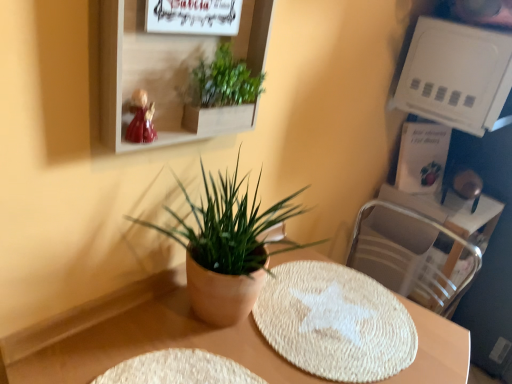
This screenshot has width=512, height=384. I want to click on vacant space underneath green matte plant at center, arranged as the 2th houseplant when viewed from the top (from a real-world perspective), so click(221, 324).